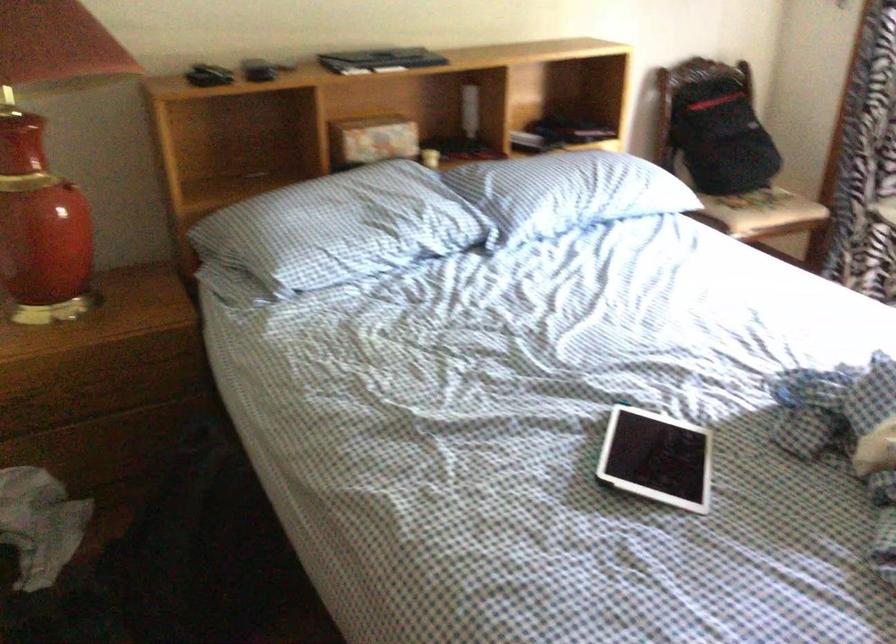
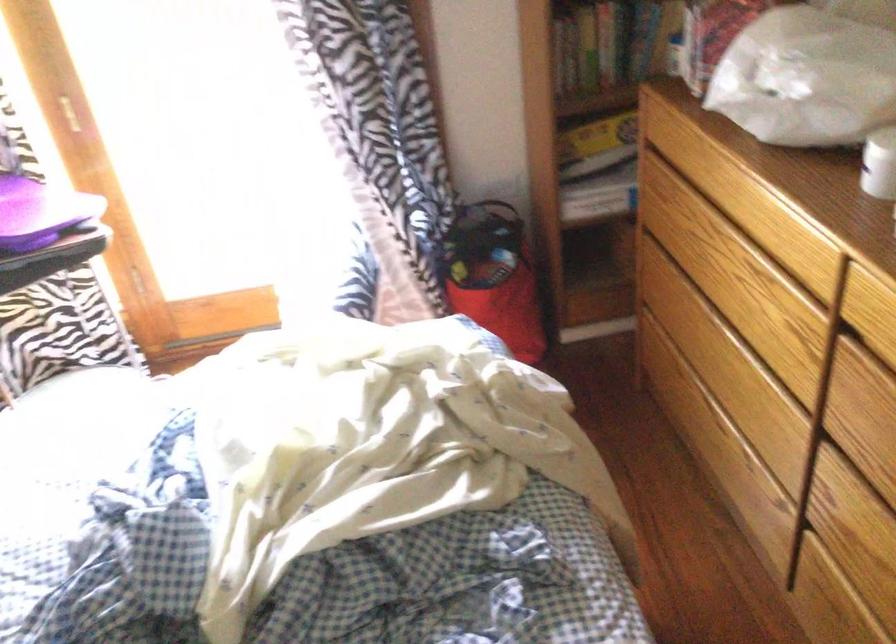
First-person continuous shooting, in which direction is the camera rotating?

The camera rotated toward right-down.